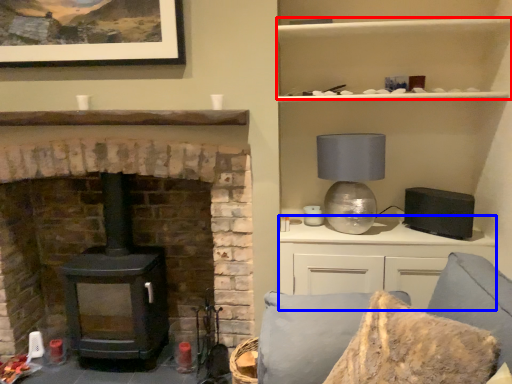
Question: Among these objects, which one is nearest to the camera, cabinet (highlighted by a red box) or entertainment center (highlighted by a blue box)?

Choices:
 (A) cabinet
 (B) entertainment center

Answer: (A)